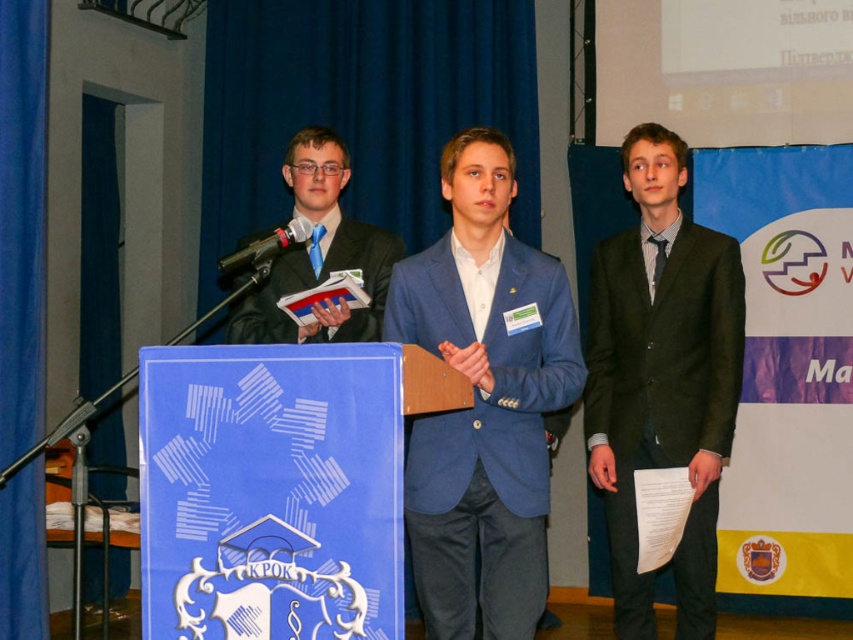
You are an event organizer who needs to place a 30 inch wide banner between the blue textured suit at center and the matte black suit at center. Can the banner fit between them without overlapping either suit?

The distance between the blue textured suit at center and the matte black suit at center is 32.60 inches, which is wider than the 30 inch banner. Therefore, the banner can fit between them without overlapping either suit.

You are an event organizer who needs to arrange seating for the speakers. The dark gray suit at right and the matte black suit at center are both presenters. Which presenter should you seat in the front row for better visibility, considering their clothing height?

The dark gray suit at right has a greater height compared to the matte black suit at center, so seating the dark gray suit at right in the front row would provide better visibility due to their taller stature.

You are an event organizer and need to arrange chairs for a photoshoot. The dark gray suit at right and the matte black suit at center are currently standing 37.59 inches apart. If the chairs are 24 inches wide each, can you place a chair between them without moving the attendees?

Result: The dark gray suit at right is 37.59 inches from the matte black suit at center. Since each chair is 24 inches wide, placing one chair between them would require at least 24 inches of space. The distance between them is sufficient as 37.59 inches is greater than 24 inches, so yes, a chair can be placed between them.